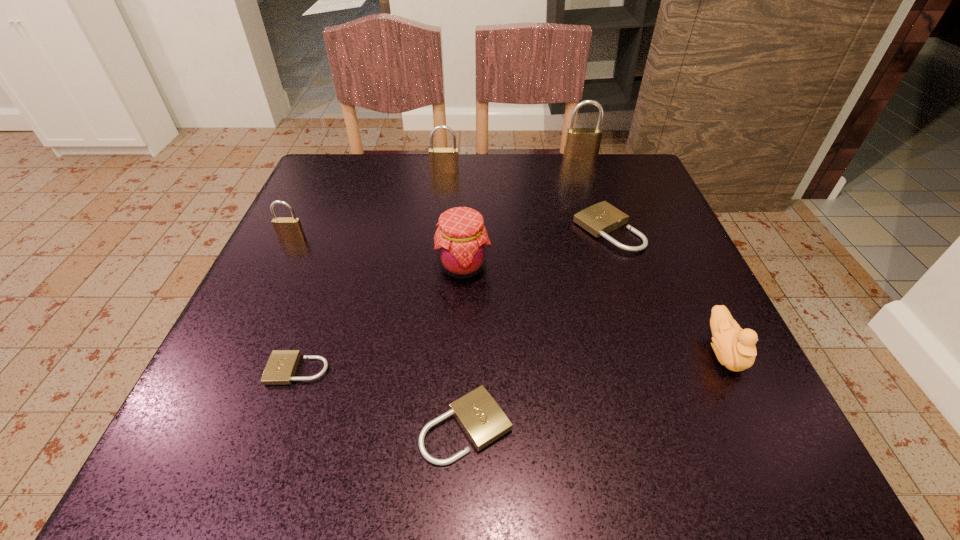
Locate an element on the screen. This screenshot has height=540, width=960. the farthest brass padlock is located at coordinates (580, 143).

The height and width of the screenshot is (540, 960). Find the location of `the farthest padlock`. the farthest padlock is located at coordinates (580, 143).

Where is `the second farthest object`? the second farthest object is located at coordinates (442, 160).

Locate an element on the screen. The height and width of the screenshot is (540, 960). the second farthest padlock is located at coordinates (442, 160).

Image resolution: width=960 pixels, height=540 pixels. I want to click on jam, so click(461, 239).

The image size is (960, 540). Identify the location of the smallest brass padlock. (286, 228).

This screenshot has width=960, height=540. What are the coordinates of `the leftmost padlock` in the screenshot? It's located at (286, 228).

Locate an element on the screen. This screenshot has height=540, width=960. the rightmost object is located at coordinates (735, 349).

Find the location of a particular element. the farthest beige padlock is located at coordinates (602, 218).

This screenshot has height=540, width=960. Find the location of `the rightmost beige padlock`. the rightmost beige padlock is located at coordinates (602, 218).